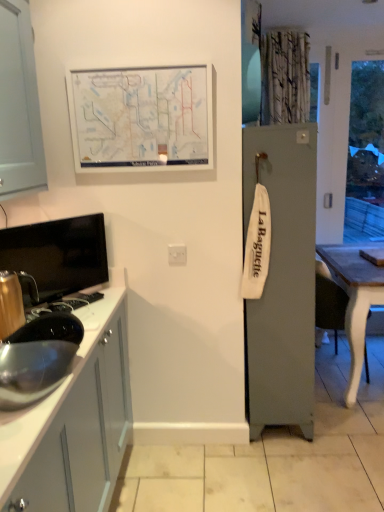
Find the location of `free space below white matte map at upper center (from a real-world perspective)`. free space below white matte map at upper center (from a real-world perspective) is located at coordinates (164, 444).